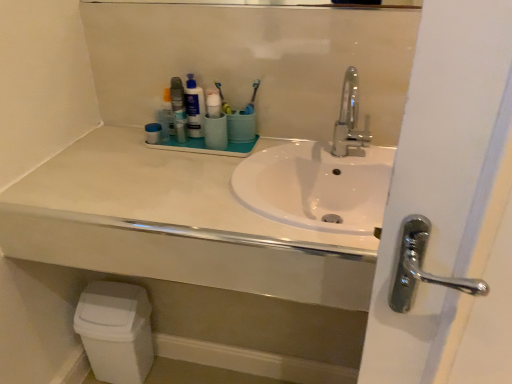
Locate an element on the screen. This screenshot has height=384, width=512. vacant area situated to the left side of blue glossy lotion at center is located at coordinates (129, 139).